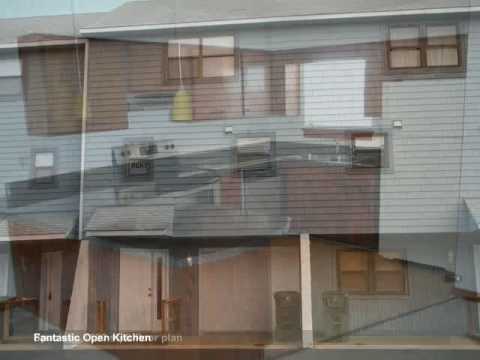
Where is `stove and oven`? The height and width of the screenshot is (360, 480). stove and oven is located at coordinates (172, 184), (132, 192), (156, 175), (192, 186).